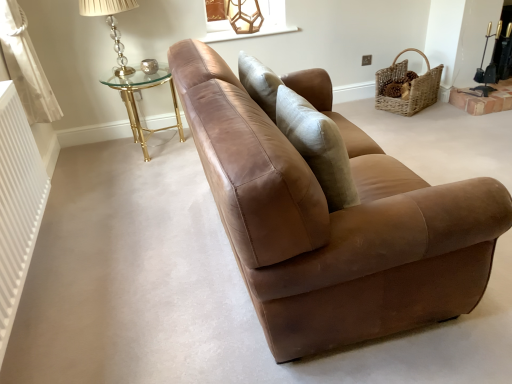
Question: Is translucent glass lampshade at upper left, the first table lamp positioned from the front, further to the viewer compared to woven natural basket at upper right?

Choices:
 (A) no
 (B) yes

Answer: (A)

Question: From a real-world perspective, is translucent glass lampshade at upper left, the second table lamp when ordered from back to front, on top of woven natural basket at upper right?

Choices:
 (A) yes
 (B) no

Answer: (A)

Question: Is translucent glass lampshade at upper left, the second table lamp when ordered from back to front, smaller than woven natural basket at upper right?

Choices:
 (A) yes
 (B) no

Answer: (A)

Question: Is translucent glass lampshade at upper left, the first table lamp positioned from the front, shorter than woven natural basket at upper right?

Choices:
 (A) yes
 (B) no

Answer: (B)

Question: Is the position of translucent glass lampshade at upper left, the 2th table lamp positioned from the right, less distant than that of woven natural basket at upper right?

Choices:
 (A) no
 (B) yes

Answer: (B)

Question: Is gold metallic glass table at upper left to the right of translucent glass lampshade at upper left, the 2th table lamp positioned from the right, from the viewer's perspective?

Choices:
 (A) yes
 (B) no

Answer: (A)

Question: From a real-world perspective, is gold metallic glass table at upper left physically below translucent glass lampshade at upper left, the 2th table lamp positioned from the right?

Choices:
 (A) no
 (B) yes

Answer: (B)

Question: From the image's perspective, is gold metallic glass table at upper left beneath translucent glass lampshade at upper left, the first table lamp positioned from the front?

Choices:
 (A) no
 (B) yes

Answer: (B)

Question: Is gold metallic glass table at upper left at the left side of translucent glass lampshade at upper left, the second table lamp when ordered from back to front?

Choices:
 (A) yes
 (B) no

Answer: (B)

Question: Is gold metallic glass table at upper left positioned beyond the bounds of translucent glass lampshade at upper left, the first table lamp positioned from the front?

Choices:
 (A) no
 (B) yes

Answer: (B)

Question: Is gold metallic glass table at upper left bigger than translucent glass lampshade at upper left, positioned as the first table lamp in left-to-right order?

Choices:
 (A) no
 (B) yes

Answer: (B)

Question: Is translucent glass lampshade at upper left, the 2th table lamp positioned from the right, not inside white ribbed radiator at left?

Choices:
 (A) no
 (B) yes

Answer: (B)